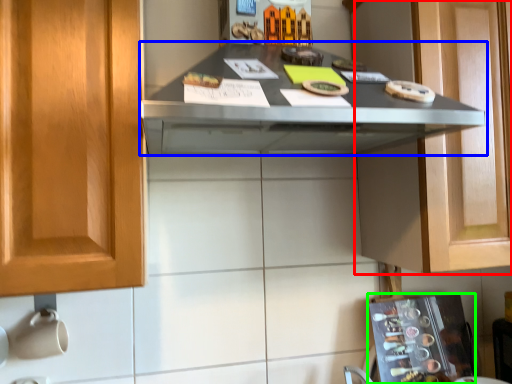
Question: Which object is positioned farthest from cabinetry (highlighted by a red box)? Select from countertop (highlighted by a blue box) and appliance (highlighted by a green box).

Choices:
 (A) countertop
 (B) appliance

Answer: (B)